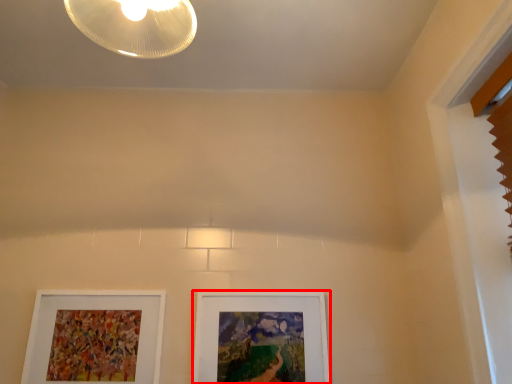
Question: From the image's perspective, what is the correct spatial relationship of picture frame (annotated by the red box) in relation to picture frame?

Choices:
 (A) above
 (B) below

Answer: (B)